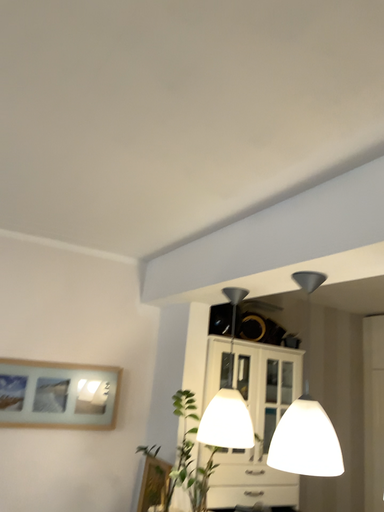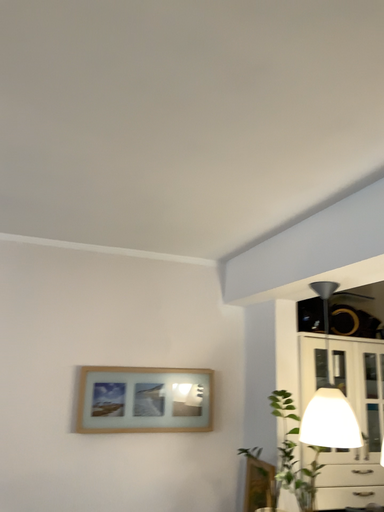
Question: Which way did the camera rotate in the video?

Choices:
 (A) rotated right
 (B) rotated left

Answer: (B)